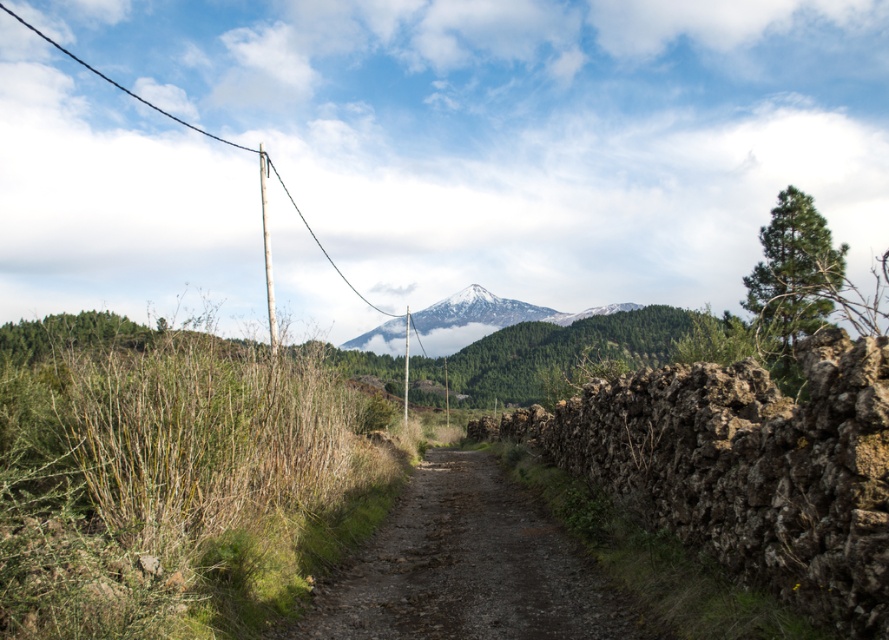
You are standing at point (x=465, y=566) in the rural landscape. What is the terrain like at that exact location?

The terrain at point (x=465, y=566) is a dusty gravel path at center.